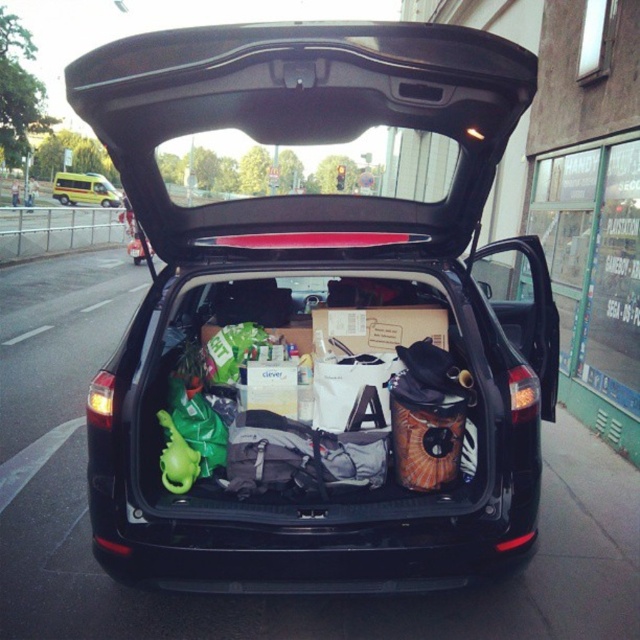
You are a delivery person trying to load a large package into the trunk of the black matte car trunk at center. The package is 1.2 meters wide. Can the package fit into the trunk if the yellow metallic van at center has a trunk width of 1 meter?

The black matte car trunk at center is wider than the yellow metallic van at center, which has a trunk width of 1 meter. Since the package is 1.2 meters wide, it can fit into the black matte car trunk at center as its width is greater than 1.2 meters.

Where is the black matte car trunk at center located in the image?

The black matte car trunk at center is located at point (314, 314) in the image.

You are a delivery person who needs to load a large package that requires a trunk space of at least 1.5 cubic meters. You see the black matte car trunk at center and the yellow metallic van at center. Which vehicle trunk can accommodate the package?

The black matte car trunk at center has a larger size compared to the yellow metallic van at center, so it can accommodate the package requiring 1.5 cubic meters.